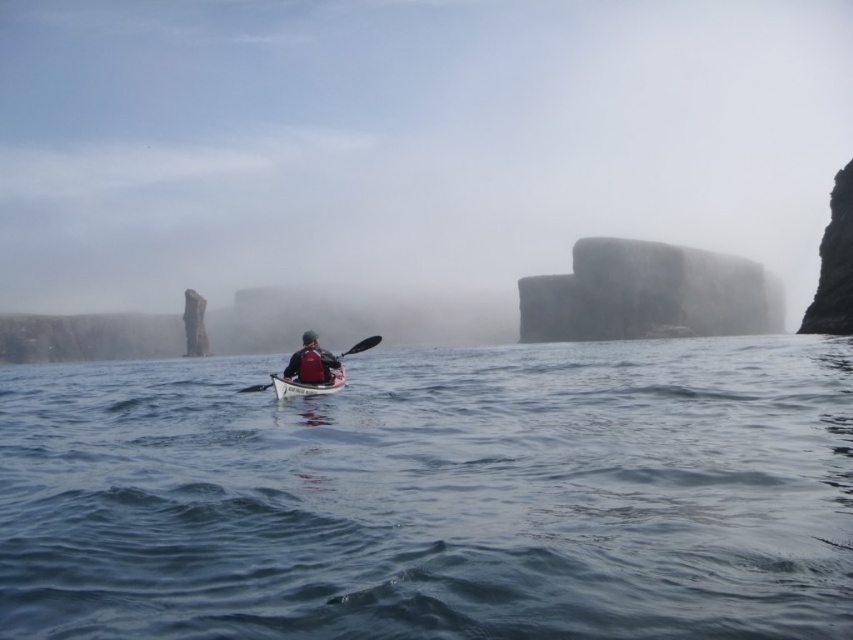
Question: Is gray stone rock formation at center below matte red life vest at center?

Choices:
 (A) yes
 (B) no

Answer: (B)

Question: Which object is the closest to the blue water at center?

Choices:
 (A) matte red life vest at center
 (B) black plastic paddle at center
 (C) matte white canoe at center
 (D) foggy stone formation at center

Answer: (A)

Question: Which point is farther to the camera?

Choices:
 (A) matte white canoe at center
 (B) gray stone rock formation at center

Answer: (B)

Question: Observing the image, what is the correct spatial positioning of foggy stone formation at center in reference to black plastic paddle at center?

Choices:
 (A) below
 (B) above

Answer: (B)

Question: Where is foggy stone formation at center located in relation to gray stone rock formation at center in the image?

Choices:
 (A) right
 (B) left

Answer: (B)

Question: Which object is positioned closest to the matte white canoe at center?

Choices:
 (A) black plastic paddle at center
 (B) blue water at center
 (C) matte red life vest at center

Answer: (C)